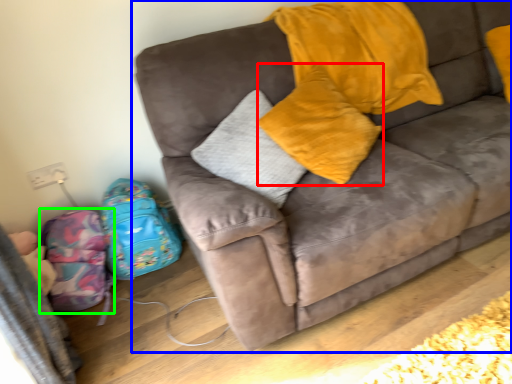
Question: Which object is positioned farthest from pillow (highlighted by a red box)? Select from studio couch (highlighted by a blue box) and luggage (highlighted by a green box).

Choices:
 (A) studio couch
 (B) luggage

Answer: (B)